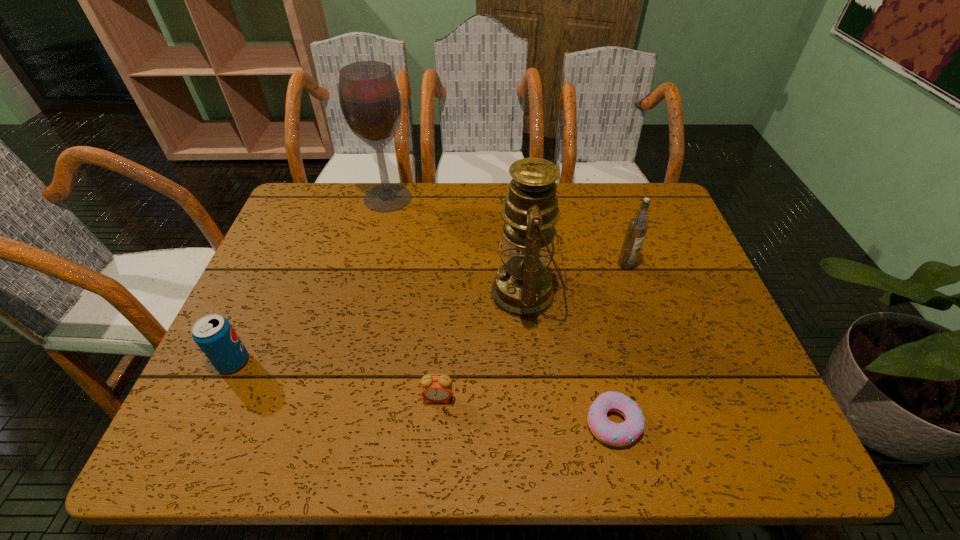
Identify the location of the shortest object. (622, 434).

Identify the location of free space located on the right of the alcohol. (512, 198).

Find the location of `free space located 0.340m on the back of the oil lamp`. free space located 0.340m on the back of the oil lamp is located at coordinates (516, 186).

You are a GUI agent. You are given a task and a screenshot of the screen. Output one action in this format:
    pyautogui.click(x=<x>, y=<y>)
    Task: Click on the vacant space positioned 0.280m on the label of the rightmost object
    
    Given the screenshot: What is the action you would take?
    pyautogui.click(x=659, y=364)

At what (x,y) coordinates should I click in order to perform the action: click on vacant space located on the back of the soda can. Please return your answer as a coordinate pair (x, y). This screenshot has height=540, width=960. Looking at the image, I should click on (261, 300).

The image size is (960, 540). What are the coordinates of `free space located 0.060m on the face of the fourth object from right to left` in the screenshot? It's located at (436, 434).

Where is `vacant space situated 0.230m on the back of the doughnut`? vacant space situated 0.230m on the back of the doughnut is located at coordinates (588, 309).

The image size is (960, 540). Find the location of `object located in the far edge section of the desktop`. object located in the far edge section of the desktop is located at coordinates (369, 96).

Identify the location of object located at the near edge. (622, 434).

Locate an element on the screen. The width and height of the screenshot is (960, 540). object situated at the left edge is located at coordinates (214, 335).